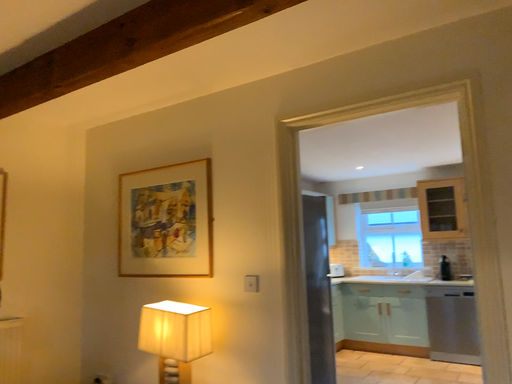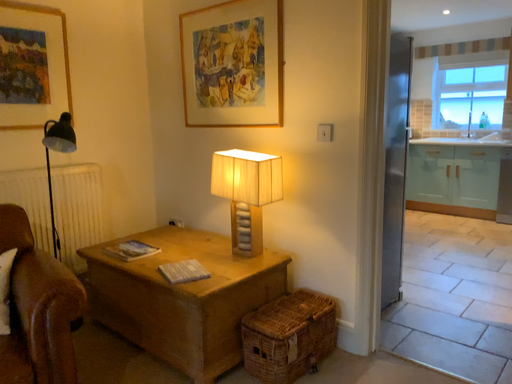
Question: Which way did the camera rotate in the video?

Choices:
 (A) rotated right
 (B) rotated left

Answer: (B)